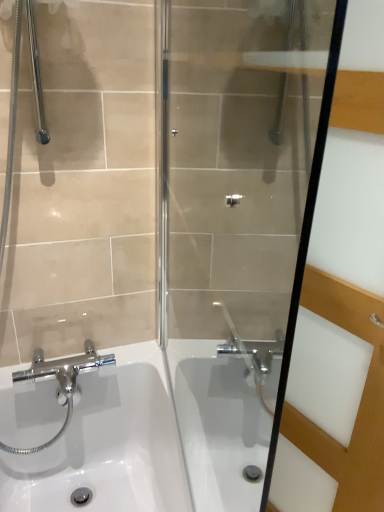
Question: From a real-world perspective, is white glossy sink at lower left above or below transparent glass screen door at center?

Choices:
 (A) below
 (B) above

Answer: (A)

Question: Would you say white glossy sink at lower left is to the left or to the right of transparent glass screen door at center in the picture?

Choices:
 (A) left
 (B) right

Answer: (A)

Question: Which of these objects is positioned farthest from the transparent glass screen door at center?

Choices:
 (A) white glossy sink at lower left
 (B) transparent glass shower door at center

Answer: (A)

Question: Estimate the real-world distances between objects in this image. Which object is farther from the transparent glass shower door at center?

Choices:
 (A) transparent glass screen door at center
 (B) white glossy sink at lower left

Answer: (B)